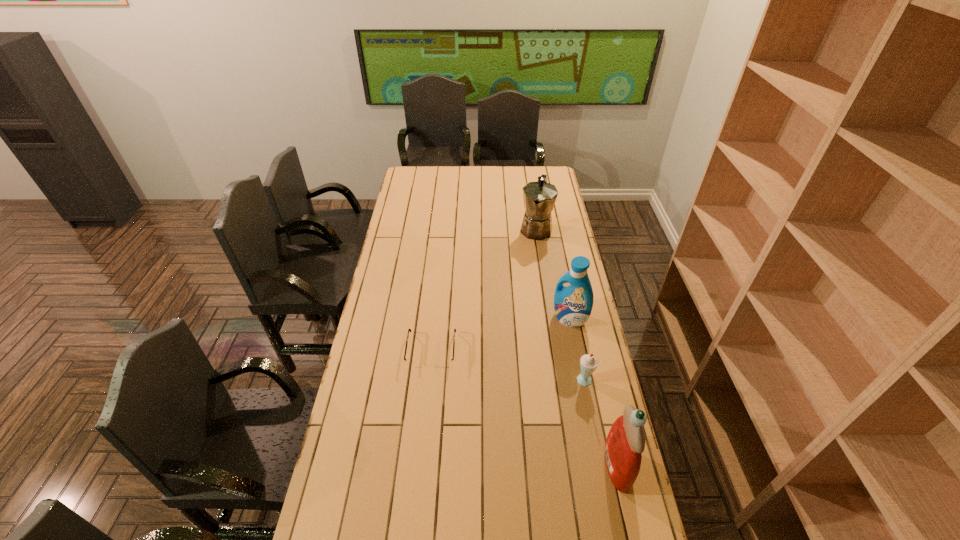
You are a GUI agent. You are given a task and a screenshot of the screen. Output one action in this format:
    pyautogui.click(x=<x>, y=<y>)
    Task: Click on the free spot located on the front-facing side of the second farthest object
    The width and height of the screenshot is (960, 540).
    Given the screenshot: What is the action you would take?
    pyautogui.click(x=541, y=349)

Locate an element on the screen. This screenshot has height=540, width=960. vacant point located on the straw side of the milkshake is located at coordinates (502, 411).

I want to click on free space located 0.330m on the straw side of the milkshake, so click(492, 415).

This screenshot has width=960, height=540. In order to click on free point located 0.340m on the straw side of the milkshake in this screenshot , I will do `click(489, 416)`.

I want to click on vacant space situated 0.080m on the pouring side of the coffeepot, so click(x=532, y=254).

The height and width of the screenshot is (540, 960). I want to click on free space located 0.320m on the pouring side of the coffeepot, so click(522, 288).

Where is `vacant position located 0.240m on the pouring side of the coffeepot`? vacant position located 0.240m on the pouring side of the coffeepot is located at coordinates (526, 276).

Image resolution: width=960 pixels, height=540 pixels. I want to click on milkshake located at the right edge, so click(x=588, y=363).

The height and width of the screenshot is (540, 960). I want to click on coffeepot located at the right edge, so click(539, 197).

In the image, there is a desktop. Where is `vacant space at the far edge`? vacant space at the far edge is located at coordinates (506, 171).